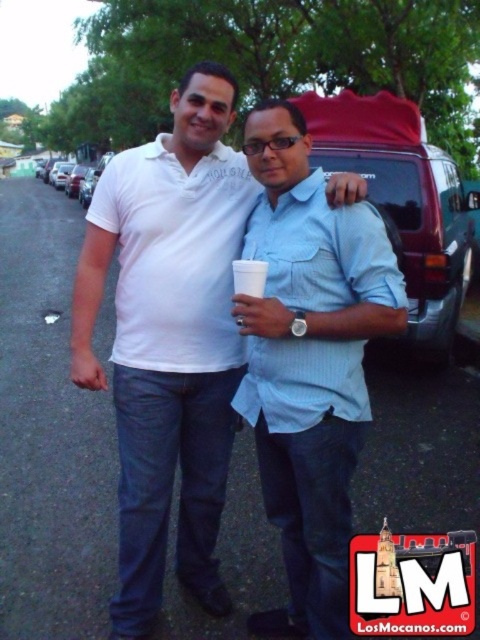
The height and width of the screenshot is (640, 480). What are the coordinates of `white cotton polo shirt at center` in the screenshot? It's located at click(x=168, y=339).

Is point (222, 147) positioned in front of point (361, 212)?

No.

This screenshot has height=640, width=480. Identify the location of white cotton polo shirt at center. (168, 339).

Consider the image. Which is below, blue striped shirt at center or light blue cotton shirt at center?

Positioned lower is blue striped shirt at center.

Who is taller, blue striped shirt at center or light blue cotton shirt at center?

blue striped shirt at center

Is point (321, 209) positioned after point (361, 349)?

No.

Where is `blue striped shirt at center`? The width and height of the screenshot is (480, 640). blue striped shirt at center is located at coordinates (310, 362).

Who is higher up, white cotton polo shirt at center or light blue cotton shirt at center?

Positioned higher is light blue cotton shirt at center.

Is white cotton polo shirt at center to the right of light blue cotton shirt at center from the viewer's perspective?

No, white cotton polo shirt at center is not to the right of light blue cotton shirt at center.

Is point (223, 365) farther from camera compared to point (311, 196)?

Yes, point (223, 365) is farther from viewer.

This screenshot has width=480, height=640. What are the coordinates of `white cotton polo shirt at center` in the screenshot? It's located at (168, 339).